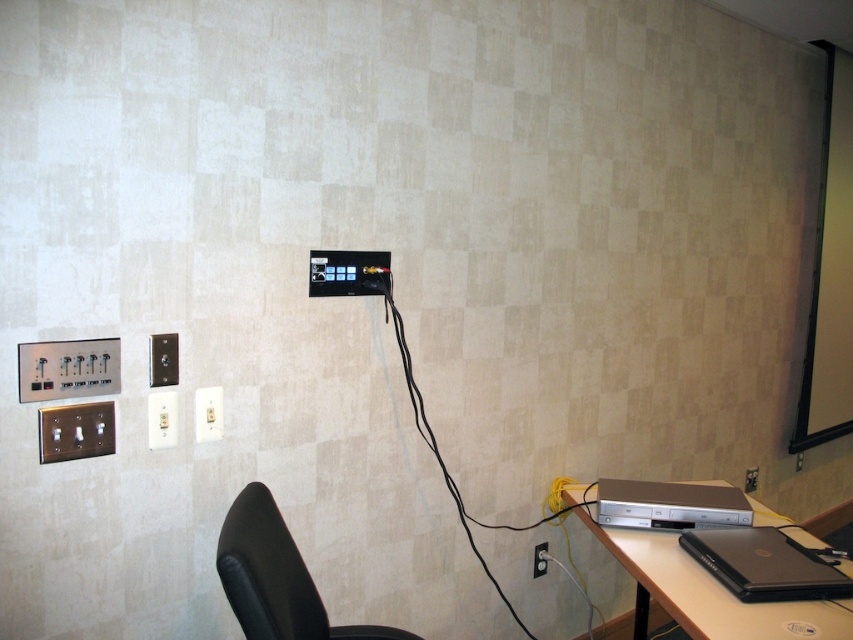
You are setting up a laptop and need to plug it into an electrical outlet. The black matte laptop at lower right requires a power cable that is 5 feet long. Is the cable long enough to reach the black plastic electrical outlet at lower right?

The black matte laptop at lower right and black plastic electrical outlet at lower right are 5.20 feet apart. Since the cable is only 5 feet long, it is 0.20 feet too short to reach the outlet. You will need a longer cable or move the laptop closer to the outlet.

You are standing in a room and looking at the wall with electrical components. There is a point marked at coordinates point (811, 611). Can you reach this point with your hand if you are 1.6 meters tall?

The point (811, 611) is 1.49 meters away from the viewer. Since the viewer is 1.6 meters tall, they can likely reach this point with their hand as it is within arm reach.